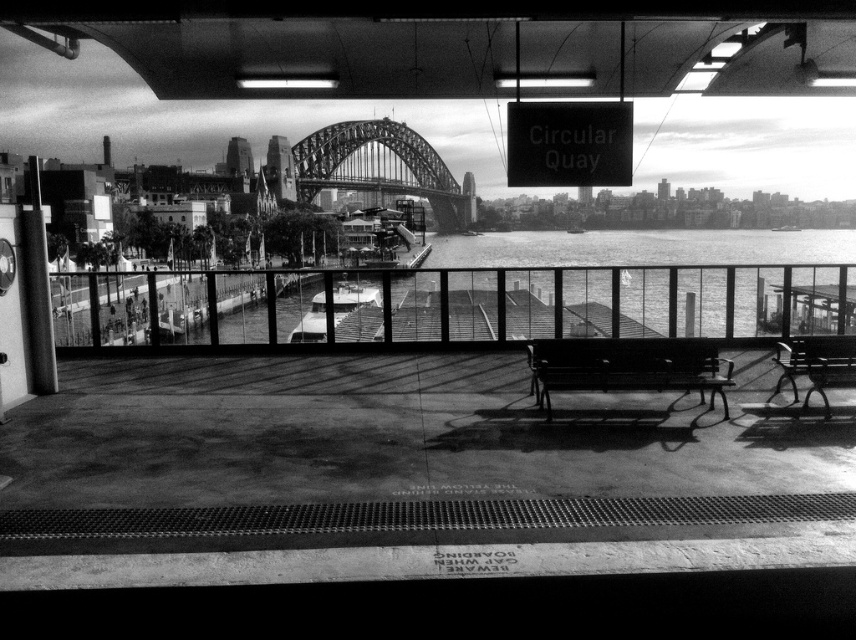
Which is below, smooth water at center or metallic polished bench at right?

metallic polished bench at right is lower down.

The height and width of the screenshot is (640, 856). Identify the location of smooth water at center. (625, 284).

What are the coordinates of `smooth water at center` in the screenshot? It's located at (625, 284).

Who is lower down, smooth water at center or metallic park bench at center?

metallic park bench at center

Between point (758, 252) and point (551, 380), which one is positioned behind?

Point (758, 252)

At what (x,y) coordinates should I click in order to perform the action: click on smooth water at center. Please return your answer as a coordinate pair (x, y). This screenshot has width=856, height=640. Looking at the image, I should click on (625, 284).

Who is positioned more to the left, metallic park bench at center or metallic polished bench at right?

metallic park bench at center

Can you confirm if metallic park bench at center is thinner than metallic polished bench at right?

Incorrect, metallic park bench at center's width is not less than metallic polished bench at right's.

The image size is (856, 640). Describe the element at coordinates (626, 368) in the screenshot. I see `metallic park bench at center` at that location.

The width and height of the screenshot is (856, 640). I want to click on metallic park bench at center, so click(626, 368).